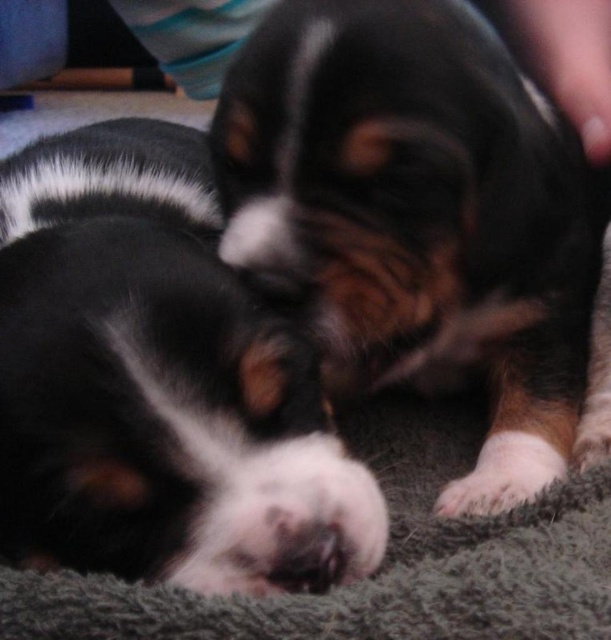
Who is taller, soft brown fur at center or white fur at lower right?

With more height is soft brown fur at center.

The width and height of the screenshot is (611, 640). In order to click on soft brown fur at center in this screenshot , I will do `click(420, 220)`.

The height and width of the screenshot is (640, 611). I want to click on soft brown fur at center, so click(x=420, y=220).

Who is more forward, (152,244) or (89,580)?

Point (89,580) is in front.

This screenshot has width=611, height=640. Describe the element at coordinates (158, 381) in the screenshot. I see `black fur dog at center` at that location.

What are the coordinates of `black fur dog at center` in the screenshot? It's located at (158, 381).

Describe the element at coordinates (420, 220) in the screenshot. This screenshot has width=611, height=640. I see `soft brown fur at center` at that location.

Between soft brown fur at center and black fur dog at center, which one appears on the left side from the viewer's perspective?

black fur dog at center is more to the left.

Where is `soft brown fur at center`? soft brown fur at center is located at coordinates (420, 220).